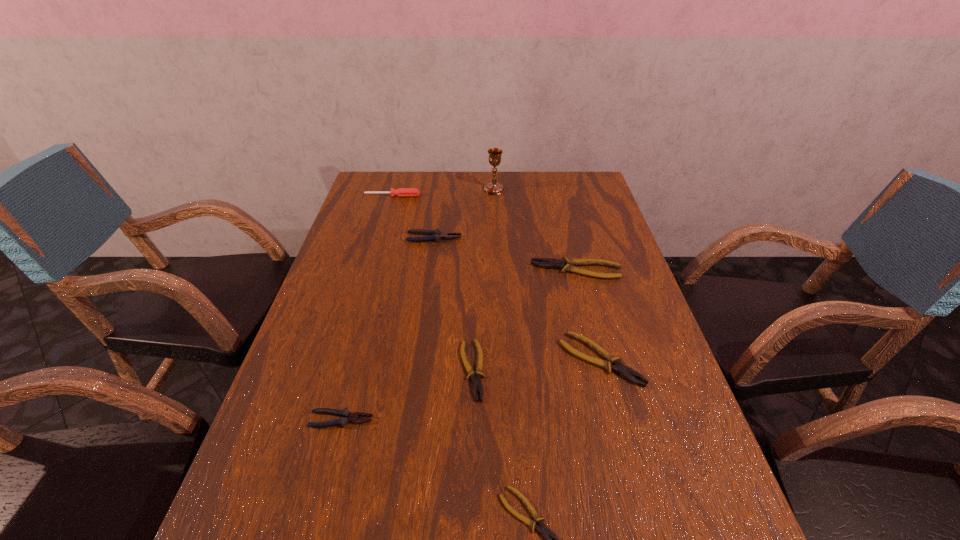
Image resolution: width=960 pixels, height=540 pixels. In order to click on screwdriver present at the far edge in this screenshot , I will do `click(400, 192)`.

What are the coordinates of `screwdriver that is at the left edge` in the screenshot? It's located at point(400,192).

The height and width of the screenshot is (540, 960). In order to click on pliers positioned at the left edge in this screenshot , I will do `click(346, 416)`.

In order to click on object positioned at the far left corner in this screenshot , I will do `click(400, 192)`.

Image resolution: width=960 pixels, height=540 pixels. Find the location of `free space at the far edge of the desktop`. free space at the far edge of the desktop is located at coordinates (516, 187).

Locate an element on the screen. Image resolution: width=960 pixels, height=540 pixels. vacant space at the left edge of the desktop is located at coordinates (321, 416).

You are a GUI agent. You are given a task and a screenshot of the screen. Output one action in this format:
    pyautogui.click(x=<x>, y=<y>)
    Task: Click on the vacant space at the right edge of the desktop
    This screenshot has width=960, height=540.
    Given the screenshot: What is the action you would take?
    pyautogui.click(x=707, y=463)

Where is `free location at the far left corner`? This screenshot has height=540, width=960. free location at the far left corner is located at coordinates (359, 200).

In order to click on free spot at the far right corner of the desktop in this screenshot , I will do `click(581, 178)`.

Locate an element on the screen. vacant area that lies between the third smallest yellow pliers and the seventh tallest object is located at coordinates (537, 365).